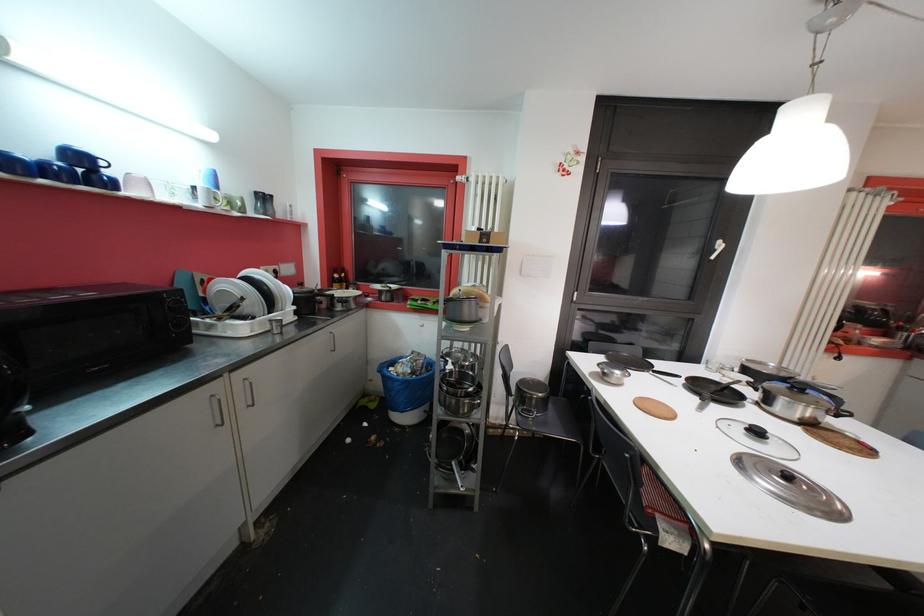
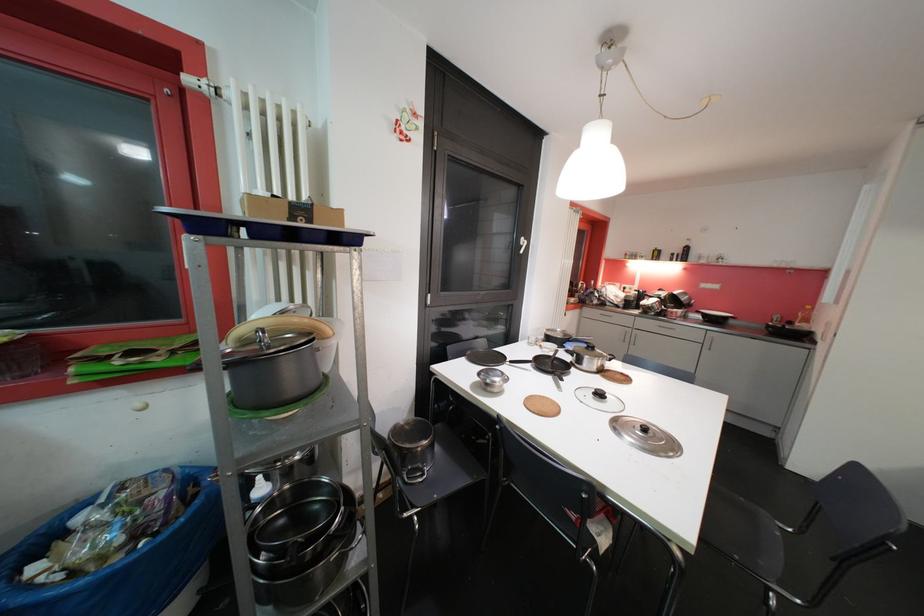
In the second image, find the point that corresponds to pixel 551 403 in the first image.

(436, 447)